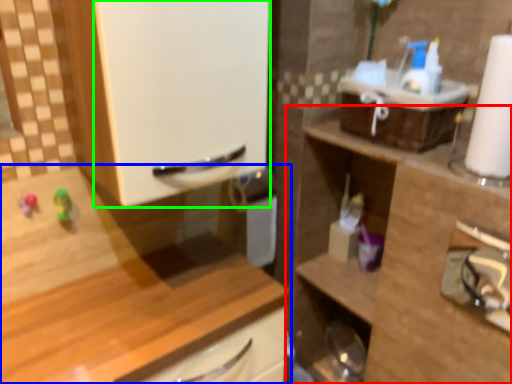
Question: Which object is positioned closest to cabinetry (highlighted by a red box)? Select from cabinetry (highlighted by a blue box) and screen door (highlighted by a green box).

Choices:
 (A) cabinetry
 (B) screen door

Answer: (A)